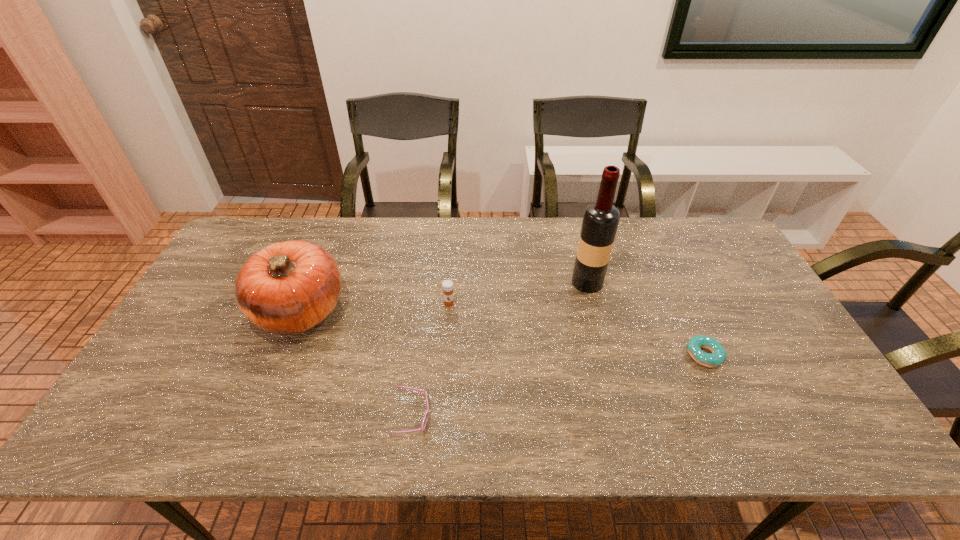
Where is `the second object from right to left`? the second object from right to left is located at coordinates (600, 221).

The image size is (960, 540). Find the location of `wine bottle`. wine bottle is located at coordinates (600, 221).

This screenshot has height=540, width=960. What are the coordinates of `the fourth shortest object` in the screenshot? It's located at [x=289, y=287].

The width and height of the screenshot is (960, 540). Identify the location of pumpkin. (289, 287).

The height and width of the screenshot is (540, 960). What are the coordinates of `the third object from left to right` in the screenshot? It's located at (447, 286).

You are a GUI agent. You are given a task and a screenshot of the screen. Output one action in this format:
    pyautogui.click(x=<x>, y=<y>)
    Task: Click on the medicine
    
    Given the screenshot: What is the action you would take?
    pyautogui.click(x=447, y=286)

Image resolution: width=960 pixels, height=540 pixels. Find the location of `the second shortest object`. the second shortest object is located at coordinates (427, 412).

This screenshot has height=540, width=960. Identify the location of the nearest object. (427, 412).

Where is `the rightmost object`? the rightmost object is located at coordinates (694, 346).

This screenshot has height=540, width=960. I want to click on doughnut, so [694, 346].